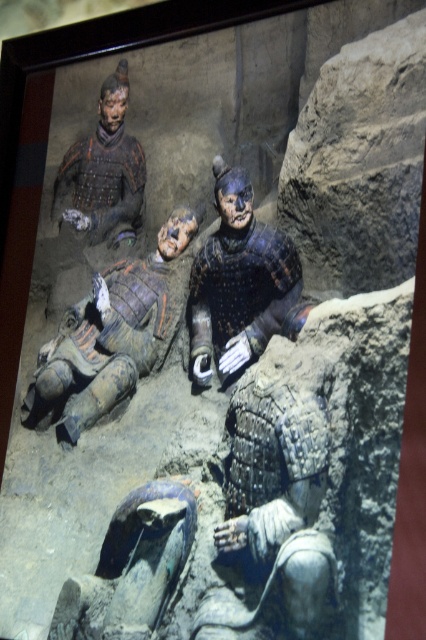
Who is positioned more to the right, shiny black armor at center or shiny metallic armor at upper left?

Positioned to the right is shiny black armor at center.

This screenshot has width=426, height=640. Identify the location of shiny black armor at center. (238, 282).

The image size is (426, 640). Describe the element at coordinates (109, 336) in the screenshot. I see `matte painted figure at center` at that location.

Does matte painted figure at center have a larger size compared to shiny black armor at center?

Yes, matte painted figure at center is bigger than shiny black armor at center.

Does point (109, 314) come closer to viewer compared to point (236, 356)?

No, (109, 314) is behind (236, 356).

Identify the location of matte painted figure at center. This screenshot has height=640, width=426. (109, 336).

Between matte painted figure at center and shiny metallic armor at upper left, which one has less height?

Standing shorter between the two is shiny metallic armor at upper left.

Does matte painted figure at center appear on the right side of shiny metallic armor at upper left?

Yes, matte painted figure at center is to the right of shiny metallic armor at upper left.

Between point (52, 365) and point (65, 177), which one is positioned behind?

Positioned behind is point (65, 177).

Locate an element on the screen. The image size is (426, 640). matte painted figure at center is located at coordinates (109, 336).